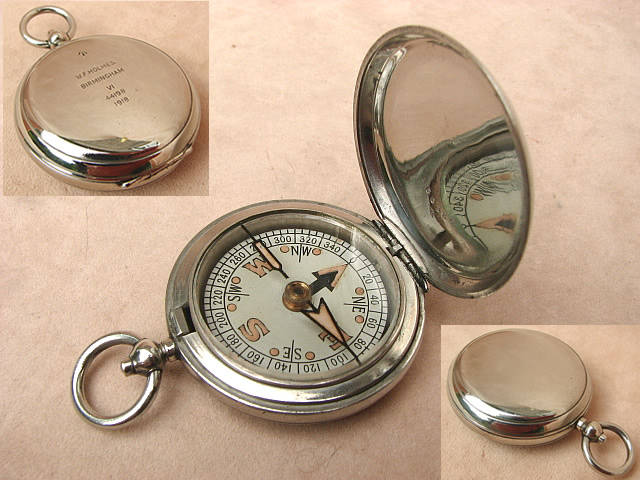
The image size is (640, 480). Find the location of `handle`. handle is located at coordinates (145, 365).